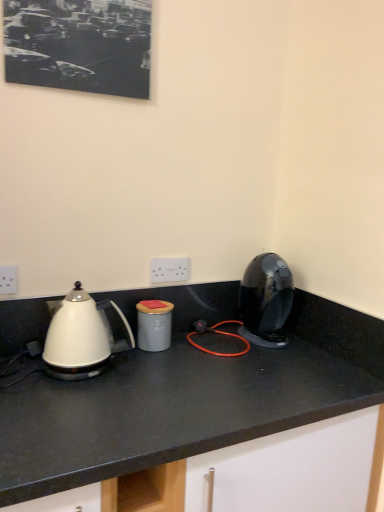
I want to click on white glossy countertop at center, so click(x=186, y=394).

The image size is (384, 512). What do you see at coordinates (8, 280) in the screenshot?
I see `white plastic electric outlet at left, which is the 2th electric outlet from right to left` at bounding box center [8, 280].

This screenshot has height=512, width=384. Describe the element at coordinates (169, 270) in the screenshot. I see `white plastic electric outlet at center, which ranks as the first electric outlet in right-to-left order` at that location.

In order to face gray matte canister at center, should I rotate leftwards or rightwards?

To face it directly, rotate left by 5.070 degrees.

Measure the distance between point (x=65, y=369) and camera.

The depth of point (x=65, y=369) is 3.86 feet.

The image size is (384, 512). Find the location of `white glossy kettle at left`. white glossy kettle at left is located at coordinates (82, 337).

Locate an element on the screen. white glossy countertop at center is located at coordinates (186, 394).

Which is more to the left, black matte picture frame at upper left or white plastic electric outlet at center, which ranks as the 1th electric outlet in back-to-front order?

black matte picture frame at upper left.

Is black matte picture frame at upper left spatially inside white plastic electric outlet at center, which ranks as the first electric outlet in right-to-left order, or outside of it?

black matte picture frame at upper left is not inside white plastic electric outlet at center, which ranks as the first electric outlet in right-to-left order, it's outside.

Based on the photo, from a real-world perspective, is black matte picture frame at upper left physically located above or below white plastic electric outlet at center, the second electric outlet positioned from the front?

In terms of real-world spatial position, black matte picture frame at upper left is above white plastic electric outlet at center, the second electric outlet positioned from the front.

Looking at this image, is white glossy countertop at center outside of gray matte canister at center?

Yes, white glossy countertop at center is not within gray matte canister at center.

Visually, is white glossy countertop at center positioned to the left or to the right of gray matte canister at center?

From the image, it's evident that white glossy countertop at center is to the right of gray matte canister at center.

Is white glossy countertop at center in front of gray matte canister at center?

Yes, it is in front of gray matte canister at center.

From the picture: Is black matte picture frame at upper left turned away from gray matte canister at center?

black matte picture frame at upper left does not have its back to gray matte canister at center.

Do you think black matte picture frame at upper left is within gray matte canister at center, or outside of it?

black matte picture frame at upper left exists outside the volume of gray matte canister at center.

In the scene shown: From the image's perspective, which object appears higher, black matte picture frame at upper left or gray matte canister at center?

black matte picture frame at upper left appears higher in the image.

From the image's perspective, does shiny black coffee machine at right appear lower than white plastic electric outlet at left, which ranks as the first electric outlet in left-to-right order?

Indeed, from the image's perspective, shiny black coffee machine at right is shown beneath white plastic electric outlet at left, which ranks as the first electric outlet in left-to-right order.

Does point (257, 338) come farther from viewer compared to point (16, 275)?

Yes, it is behind point (16, 275).

Is shiny black coffee machine at right next to white plastic electric outlet at left, arranged as the 1th electric outlet when viewed from the front?

No, shiny black coffee machine at right is not beside white plastic electric outlet at left, arranged as the 1th electric outlet when viewed from the front.

Which is in front, gray matte canister at center or white glossy countertop at center?

white glossy countertop at center is in front.

From the picture: How different are the orientations of gray matte canister at center and white glossy countertop at center in degrees?

2.07 degrees separate the facing orientations of gray matte canister at center and white glossy countertop at center.

Is gray matte canister at center not close to white glossy countertop at center?

That's not correct — gray matte canister at center is a little close to white glossy countertop at center.

Is white plastic electric outlet at center, which ranks as the 1th electric outlet in back-to-front order, aimed at black matte picture frame at upper left?

No, white plastic electric outlet at center, which ranks as the 1th electric outlet in back-to-front order, is not facing towards black matte picture frame at upper left.

Based on the photo, is there a large distance between white plastic electric outlet at center, the second electric outlet positioned from the front, and black matte picture frame at upper left?

No.

Considering the sizes of objects white plastic electric outlet at center, the second electric outlet positioned from the front, and black matte picture frame at upper left in the image provided, who is smaller, white plastic electric outlet at center, the second electric outlet positioned from the front, or black matte picture frame at upper left?

white plastic electric outlet at center, the second electric outlet positioned from the front.

From the image's perspective, is white plastic electric outlet at center, the second electric outlet positioned from the front, above or below black matte picture frame at upper left?

white plastic electric outlet at center, the second electric outlet positioned from the front, is situated lower than black matte picture frame at upper left in the image.

Does point (140, 311) lie behind point (95, 309)?

Yes, point (140, 311) is behind point (95, 309).

From the image's perspective, would you say gray matte canister at center is shown under white glossy kettle at left?

Yes, from the image's perspective, gray matte canister at center is beneath white glossy kettle at left.

From a real-world perspective, between gray matte canister at center and white glossy kettle at left, who is vertically lower?

gray matte canister at center.

Would you consider gray matte canister at center to be distant from white glossy kettle at left?

No.

The image size is (384, 512). I want to click on picture frame in front of the white plastic electric outlet at center, which is the 2th electric outlet in left-to-right order, so click(79, 45).

Identify the location of countertop below the gray matte canister at center (from the image's perspective). The width and height of the screenshot is (384, 512). (186, 394).

Based on their spatial positions, is white plastic electric outlet at center, which is the 2th electric outlet in left-to-right order, or white glossy kettle at left closer to gray matte canister at center?

Among the two, white plastic electric outlet at center, which is the 2th electric outlet in left-to-right order, is located nearer to gray matte canister at center.

Consider the image. Looking at the image, which one is located closer to white glossy countertop at center, gray matte canister at center or white plastic electric outlet at left, which is the 2th electric outlet from right to left?

Based on the image, gray matte canister at center appears to be nearer to white glossy countertop at center.

Which object lies further to the anchor point gray matte canister at center, white plastic electric outlet at left, the 2th electric outlet when ordered from back to front, or white glossy countertop at center?

Among the two, white plastic electric outlet at left, the 2th electric outlet when ordered from back to front, is located further to gray matte canister at center.

Looking at the image, which one is located further to gray matte canister at center, white plastic electric outlet at left, which ranks as the first electric outlet in left-to-right order, or white plastic electric outlet at center, which is the 2th electric outlet in left-to-right order?

Among the two, white plastic electric outlet at left, which ranks as the first electric outlet in left-to-right order, is located further to gray matte canister at center.

From the image, which object appears to be nearer to shiny black coffee machine at right, white glossy kettle at left or gray matte canister at center?

gray matte canister at center lies closer to shiny black coffee machine at right than the other object.

Considering their positions, is shiny black coffee machine at right positioned closer to white glossy kettle at left than white plastic electric outlet at left, which is the 2th electric outlet from right to left?

white plastic electric outlet at left, which is the 2th electric outlet from right to left, is closer to white glossy kettle at left.

Considering their positions, is white plastic electric outlet at center, which is the 2th electric outlet in left-to-right order, positioned further to shiny black coffee machine at right than white glossy kettle at left?

Based on the image, white glossy kettle at left appears to be further to shiny black coffee machine at right.

From the image, which object appears to be farther from white glossy kettle at left, gray matte canister at center or white plastic electric outlet at left, which ranks as the first electric outlet in left-to-right order?

white plastic electric outlet at left, which ranks as the first electric outlet in left-to-right order, is further to white glossy kettle at left.

Locate an element on the screen. The image size is (384, 512). appliance between white glossy kettle at left and white plastic electric outlet at center, which ranks as the 1th electric outlet in back-to-front order, along the z-axis is located at coordinates (154, 325).

Locate an element on the screen. Image resolution: width=384 pixels, height=512 pixels. picture frame situated between white plastic electric outlet at left, arranged as the 1th electric outlet when viewed from the front, and shiny black coffee machine at right from left to right is located at coordinates (79, 45).

Where is `home appliance between black matte picture frame at upper left and white glossy kettle at left vertically`? The image size is (384, 512). home appliance between black matte picture frame at upper left and white glossy kettle at left vertically is located at coordinates (266, 300).

Find the location of a particular element. electric outlet between white plastic electric outlet at center, which ranks as the 1th electric outlet in back-to-front order, and white glossy countertop at center, in the vertical direction is located at coordinates (8, 280).